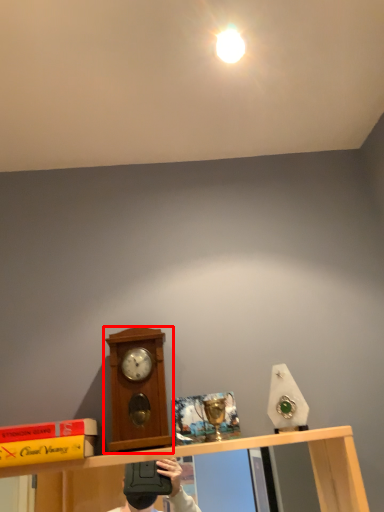
Question: From the image's perspective, considering the relative positions of clock (annotated by the red box) and light in the image provided, where is clock (annotated by the red box) located with respect to the staircase?

Choices:
 (A) above
 (B) below

Answer: (B)